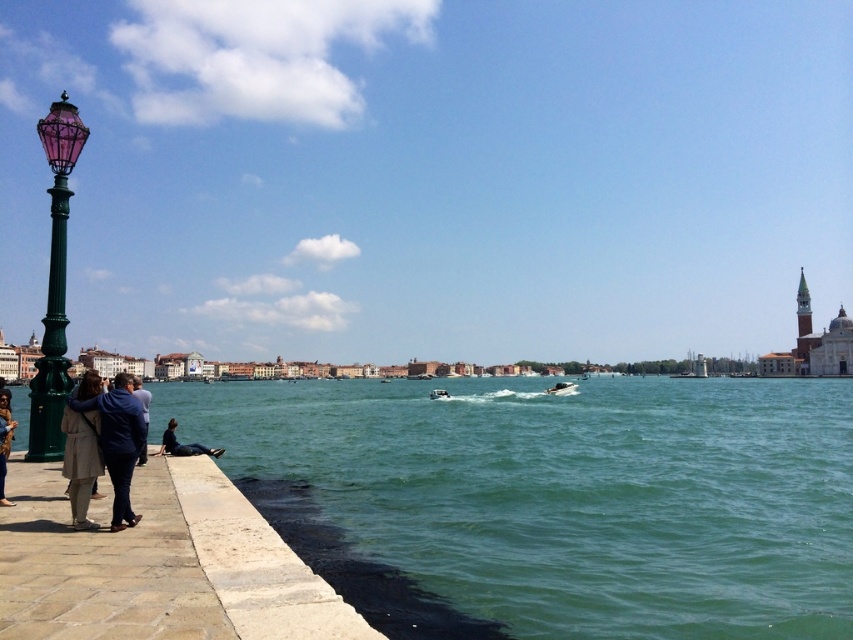
Question: Does beige fabric coat at lower left have a larger size compared to metallic silver boat at center?

Choices:
 (A) no
 (B) yes

Answer: (B)

Question: Among these points, which one is farthest from the camera?

Choices:
 (A) (560, 577)
 (B) (186, 451)
 (C) (12, 426)
 (D) (572, 392)

Answer: (D)

Question: Is light beige fabric coat at lower left to the right of metallic silver boat at center from the viewer's perspective?

Choices:
 (A) yes
 (B) no

Answer: (B)

Question: Which point is farther to the camera?

Choices:
 (A) (78, 426)
 (B) (4, 428)
 (C) (86, 376)
 (D) (573, 385)

Answer: (D)

Question: Is dark blue jeans at lower left positioned in front of dark blue hoodie at lower left?

Choices:
 (A) no
 (B) yes

Answer: (A)

Question: Which is nearer to the light beige coat at lower left?

Choices:
 (A) dark blue hoodie at lower left
 (B) metallic silver boat at center

Answer: (A)